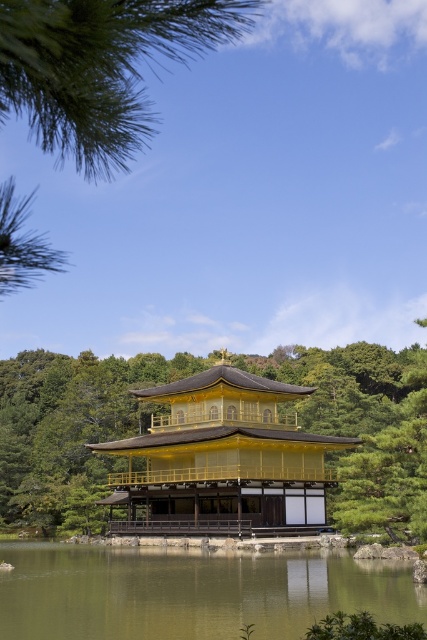
You are standing at the Golden Pavilion and want to locate a specific point in the image. The point is marked at coordinates point (101, 67). Based on the scene description, where would this point be located?

The point (101, 67) is on green needle like leaves at upper left.

You are standing on the edge of the calm body of water at the Golden Pavilion. You want to place a small floating lantern on the water surface. Considering the height difference between the green liquid water at center and the gold lacquered wood temple at center, will the lantern float closer to the temple or further away?

The green liquid water at center has a lesser height compared to the gold lacquered wood temple at center. Since the water is lower, the floating lantern will naturally float closer to the temple as it follows the water surface level.